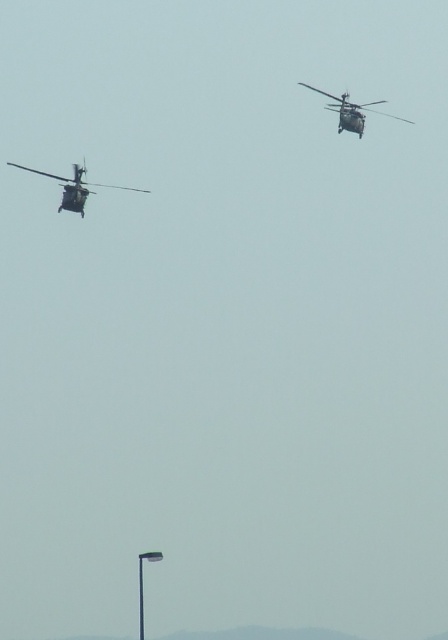
Question: Which point is farther to the camera?

Choices:
 (A) (81, 205)
 (B) (361, 134)

Answer: (B)

Question: Which of the following is the farthest from the observer?

Choices:
 (A) (22, 168)
 (B) (353, 108)

Answer: (A)

Question: Can you confirm if metallic gray helicopter at left is wider than metallic gray helicopter at upper right?

Choices:
 (A) yes
 (B) no

Answer: (A)

Question: Among these objects, which one is nearest to the camera?

Choices:
 (A) metallic gray helicopter at left
 (B) metallic gray helicopter at upper right

Answer: (B)

Question: Observing the image, what is the correct spatial positioning of metallic gray helicopter at left in reference to metallic gray helicopter at upper right?

Choices:
 (A) below
 (B) above

Answer: (A)

Question: Does metallic gray helicopter at left lie in front of metallic gray helicopter at upper right?

Choices:
 (A) yes
 (B) no

Answer: (B)